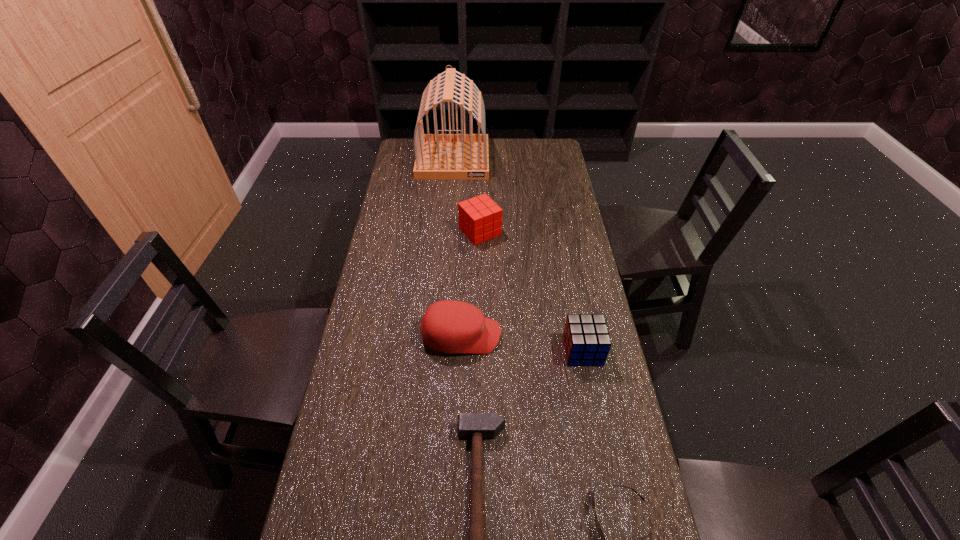
I want to click on the farthest object, so tap(437, 156).

What are the coordinates of `the tallest object` in the screenshot? It's located at (437, 156).

At what (x,y) coordinates should I click in order to perform the action: click on the left cube. Please return your answer as a coordinate pair (x, y). Looking at the image, I should click on (480, 218).

Find the location of a particular element. The width and height of the screenshot is (960, 540). the farther cube is located at coordinates (480, 218).

You are a GUI agent. You are given a task and a screenshot of the screen. Output one action in this format:
    pyautogui.click(x=<x>, y=<y>)
    Task: Click on the cap
    
    Given the screenshot: What is the action you would take?
    pyautogui.click(x=449, y=326)

You are a GUI agent. You are given a task and a screenshot of the screen. Output one action in this format:
    pyautogui.click(x=<x>, y=<y>)
    Task: Click on the nearer cube
    
    Given the screenshot: What is the action you would take?
    pyautogui.click(x=586, y=339)

This screenshot has height=540, width=960. In order to click on blank area located with an open door on the birdcage in this screenshot , I will do `click(449, 208)`.

Where is `free space located on the left of the left cube`? The width and height of the screenshot is (960, 540). free space located on the left of the left cube is located at coordinates (382, 232).

Image resolution: width=960 pixels, height=540 pixels. What are the coordinates of `vacant point located on the front-facing side of the cap` in the screenshot? It's located at (535, 336).

Where is `free space located 0.200m on the front of the right cube`? free space located 0.200m on the front of the right cube is located at coordinates (599, 435).